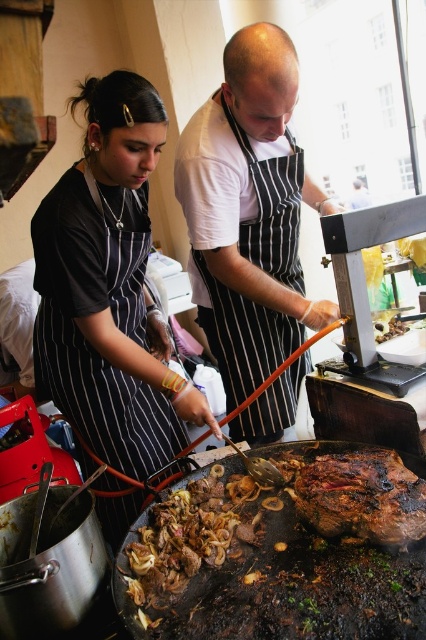
You are a customer at this food stall and want to know which item is taller between the brown crispy meat at center and the brown crispy bread at center. Can you tell me?

The brown crispy meat at center is taller than the brown crispy bread at center according to the description.

You are standing in front of the food stall and see two points marked in the image. Which point, point (399, 460) or point (374, 336), is closer to you?

Point (399, 460) is closer to the viewer than point (374, 336).

What is the object located at the coordinates point [249,212] in the image?

The point [249,212] marks the white striped apron at center.